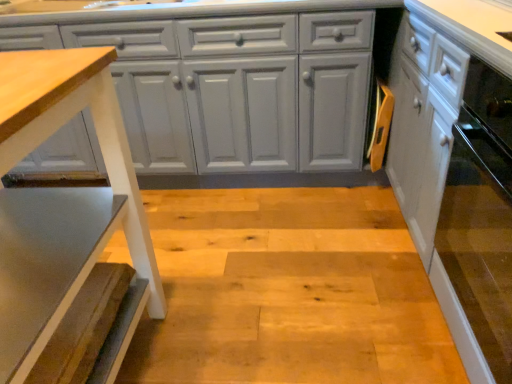
Image resolution: width=512 pixels, height=384 pixels. I want to click on white glossy cabinet at right, the first cabinetry viewed from the right, so click(458, 169).

Locate an element on the screen. white glossy cabinet at right, the first cabinetry viewed from the right is located at coordinates (458, 169).

From the image's perspective, which one is positioned lower, white glossy cabinet at right, the first cabinetry viewed from the right, or wooden textured step stool at left?

wooden textured step stool at left, from the image's perspective.

Based on the photo, could you measure the distance between white glossy cabinet at right, placed as the 2th cabinetry when sorted from left to right, and wooden textured step stool at left?

white glossy cabinet at right, placed as the 2th cabinetry when sorted from left to right, is 36.18 inches away from wooden textured step stool at left.

Does point (509, 91) come farther from viewer compared to point (0, 186)?

No, (509, 91) is closer to viewer.

Locate an element on the screen. step stool below the white glossy cabinet at right, placed as the 2th cabinetry when sorted from left to right (from the image's perspective) is located at coordinates (66, 122).

Is wooden textured step stool at left at the right side of matte gray cabinet at center, which appears as the 1th cabinetry when viewed from the left?

Incorrect, wooden textured step stool at left is not on the right side of matte gray cabinet at center, which appears as the 1th cabinetry when viewed from the left.

Does wooden textured step stool at left turn towards matte gray cabinet at center, which appears as the 1th cabinetry when viewed from the left?

No, wooden textured step stool at left is not aimed at matte gray cabinet at center, which appears as the 1th cabinetry when viewed from the left.

Are wooden textured step stool at left and matte gray cabinet at center, which ranks as the 2th cabinetry in right-to-left order, located far from each other?

No, wooden textured step stool at left is in close proximity to matte gray cabinet at center, which ranks as the 2th cabinetry in right-to-left order.

From a real-world perspective, is wooden textured step stool at left above or below matte gray cabinet at center, which appears as the 1th cabinetry when viewed from the left?

In terms of real-world spatial position, wooden textured step stool at left is above matte gray cabinet at center, which appears as the 1th cabinetry when viewed from the left.

Does white glossy cabinet at right, the first cabinetry viewed from the right, have a smaller size compared to matte gray cabinet at center, which ranks as the 2th cabinetry in right-to-left order?

Yes, white glossy cabinet at right, the first cabinetry viewed from the right, is smaller than matte gray cabinet at center, which ranks as the 2th cabinetry in right-to-left order.

Can you confirm if white glossy cabinet at right, the first cabinetry viewed from the right, is shorter than matte gray cabinet at center, which appears as the 1th cabinetry when viewed from the left?

No, white glossy cabinet at right, the first cabinetry viewed from the right, is not shorter than matte gray cabinet at center, which appears as the 1th cabinetry when viewed from the left.

Considering the relative sizes of white glossy cabinet at right, placed as the 2th cabinetry when sorted from left to right, and matte gray cabinet at center, which appears as the 1th cabinetry when viewed from the left, in the image provided, is white glossy cabinet at right, placed as the 2th cabinetry when sorted from left to right, wider than matte gray cabinet at center, which appears as the 1th cabinetry when viewed from the left,?

No, white glossy cabinet at right, placed as the 2th cabinetry when sorted from left to right, is not wider than matte gray cabinet at center, which appears as the 1th cabinetry when viewed from the left.

Is the depth of wooden textured step stool at left greater than that of white glossy cabinet at right, the first cabinetry viewed from the right?

That is False.

From a real-world perspective, between wooden textured step stool at left and white glossy cabinet at right, placed as the 2th cabinetry when sorted from left to right, who is vertically higher?

wooden textured step stool at left is physically above.

Is wooden textured step stool at left turned away from white glossy cabinet at right, placed as the 2th cabinetry when sorted from left to right?

Absolutely, wooden textured step stool at left is directed away from white glossy cabinet at right, placed as the 2th cabinetry when sorted from left to right.

Locate an element on the screen. step stool lying below the matte gray cabinet at center, which ranks as the 2th cabinetry in right-to-left order (from the image's perspective) is located at coordinates (66, 122).

Can you confirm if matte gray cabinet at center, which appears as the 1th cabinetry when viewed from the left, is bigger than wooden textured step stool at left?

Yes.

Which is more to the left, matte gray cabinet at center, which ranks as the 2th cabinetry in right-to-left order, or wooden textured step stool at left?

wooden textured step stool at left is more to the left.

From the image's perspective, is matte gray cabinet at center, which ranks as the 2th cabinetry in right-to-left order, located beneath white glossy cabinet at right, the first cabinetry viewed from the right?

No, from the image's perspective, matte gray cabinet at center, which ranks as the 2th cabinetry in right-to-left order, is not beneath white glossy cabinet at right, the first cabinetry viewed from the right.

Is matte gray cabinet at center, which appears as the 1th cabinetry when viewed from the left, thinner than white glossy cabinet at right, the first cabinetry viewed from the right?

In fact, matte gray cabinet at center, which appears as the 1th cabinetry when viewed from the left, might be wider than white glossy cabinet at right, the first cabinetry viewed from the right.

Between matte gray cabinet at center, which ranks as the 2th cabinetry in right-to-left order, and white glossy cabinet at right, placed as the 2th cabinetry when sorted from left to right, which one appears on the left side from the viewer's perspective?

matte gray cabinet at center, which ranks as the 2th cabinetry in right-to-left order.

Locate an element on the screen. The width and height of the screenshot is (512, 384). cabinetry on the left of white glossy cabinet at right, placed as the 2th cabinetry when sorted from left to right is located at coordinates (234, 89).

The width and height of the screenshot is (512, 384). What are the coordinates of `step stool above the white glossy cabinet at right, placed as the 2th cabinetry when sorted from left to right (from a real-world perspective)` in the screenshot? It's located at (66, 122).

There is a wooden textured step stool at left. Where is `the 2nd cabinetry above it (from the image's perspective)`? The image size is (512, 384). the 2nd cabinetry above it (from the image's perspective) is located at coordinates (234, 89).

Estimate the real-world distances between objects in this image. Which object is further from white glossy cabinet at right, the first cabinetry viewed from the right, wooden textured step stool at left or matte gray cabinet at center, which ranks as the 2th cabinetry in right-to-left order?

The object further to white glossy cabinet at right, the first cabinetry viewed from the right, is wooden textured step stool at left.

When comparing their distances from wooden textured step stool at left, does matte gray cabinet at center, which ranks as the 2th cabinetry in right-to-left order, or white glossy cabinet at right, placed as the 2th cabinetry when sorted from left to right, seem further?

white glossy cabinet at right, placed as the 2th cabinetry when sorted from left to right.

Looking at the image, which one is located further to matte gray cabinet at center, which ranks as the 2th cabinetry in right-to-left order, white glossy cabinet at right, placed as the 2th cabinetry when sorted from left to right, or wooden textured step stool at left?

Based on the image, wooden textured step stool at left appears to be further to matte gray cabinet at center, which ranks as the 2th cabinetry in right-to-left order.

Looking at the image, which one is located further to white glossy cabinet at right, placed as the 2th cabinetry when sorted from left to right, matte gray cabinet at center, which ranks as the 2th cabinetry in right-to-left order, or wooden textured step stool at left?

Among the two, wooden textured step stool at left is located further to white glossy cabinet at right, placed as the 2th cabinetry when sorted from left to right.

Estimate the real-world distances between objects in this image. Which object is closer to matte gray cabinet at center, which appears as the 1th cabinetry when viewed from the left, wooden textured step stool at left or white glossy cabinet at right, the first cabinetry viewed from the right?

Among the two, white glossy cabinet at right, the first cabinetry viewed from the right, is located nearer to matte gray cabinet at center, which appears as the 1th cabinetry when viewed from the left.

Based on their spatial positions, is white glossy cabinet at right, placed as the 2th cabinetry when sorted from left to right, or matte gray cabinet at center, which appears as the 1th cabinetry when viewed from the left, further from wooden textured step stool at left?

The object further to wooden textured step stool at left is white glossy cabinet at right, placed as the 2th cabinetry when sorted from left to right.

The width and height of the screenshot is (512, 384). What are the coordinates of `cabinetry between wooden textured step stool at left and white glossy cabinet at right, placed as the 2th cabinetry when sorted from left to right` in the screenshot? It's located at (234, 89).